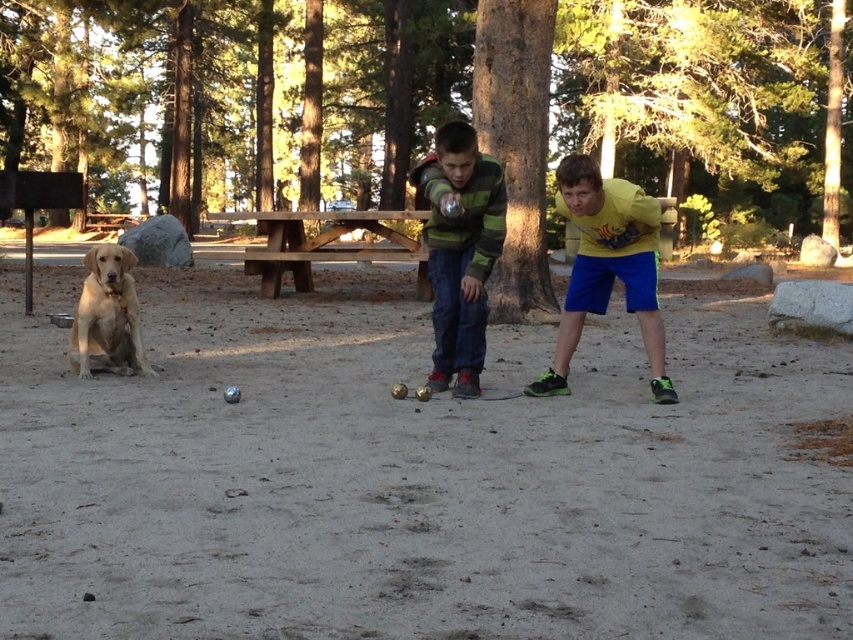
Can you confirm if brown sandy ground at center is smaller than brown wooden picnic table at center?

Actually, brown sandy ground at center might be larger than brown wooden picnic table at center.

Is brown sandy ground at center bigger than brown wooden picnic table at center?

Yes, brown sandy ground at center is bigger than brown wooden picnic table at center.

Does point (669, 496) lie behind point (294, 252)?

No, it is in front of (294, 252).

The height and width of the screenshot is (640, 853). What are the coordinates of `brown sandy ground at center` in the screenshot? It's located at (415, 477).

Who is more forward, (x=503, y=236) or (x=660, y=211)?

Positioned in front is point (x=660, y=211).

Between point (473, 224) and point (660, 362), which one is positioned behind?

The point (660, 362) is more distant.

The width and height of the screenshot is (853, 640). What are the coordinates of `green striped sweater at center` in the screenshot? It's located at (460, 250).

Is yellow matte shirt at center thinner than golden fur dog at left?

No.

Is yellow matte shirt at center to the right of golden fur dog at left from the viewer's perspective?

Yes, yellow matte shirt at center is to the right of golden fur dog at left.

Locate an element on the screen. yellow matte shirt at center is located at coordinates (607, 266).